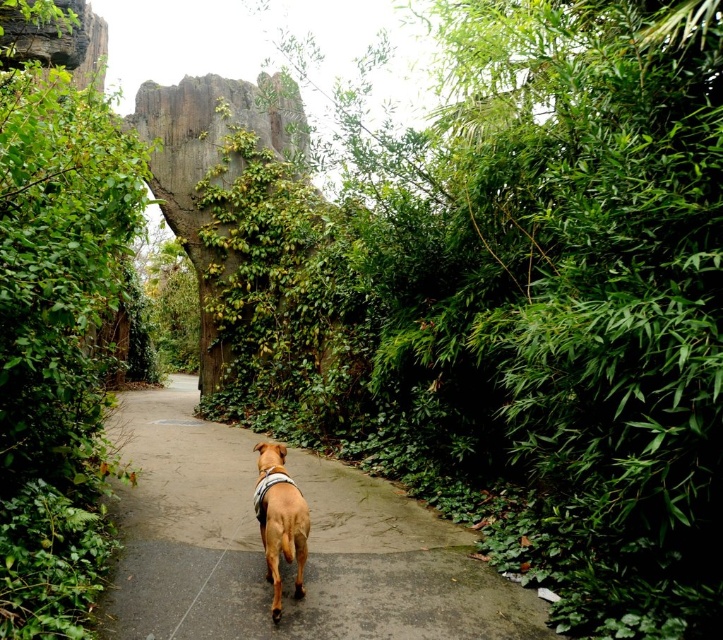
You are a gardener trying to trim the green leafy foliage at center and the green leafy bush at left. Which one do you need to reach higher to trim?

The green leafy foliage at center is positioned over the green leafy bush at left, so you need to reach higher to trim the green leafy foliage at center.

You are a hiker trying to navigate through the narrow pathway. You notice the green leafy foliage at center and the brown concrete path at center. Which one takes up more space in the scene?

The green leafy foliage at center has a larger size compared to the brown concrete path at center, so it takes up more space in the scene.

You are a hiker standing on the narrow pathway in the scene. You want to take a photo of both the green leafy foliage at center and the green mossy rock at center in the same frame. Which object should you focus on first to ensure both are in the shot?

You should focus on the green mossy rock at center first since it is taller than the green leafy foliage at center, so it will occupy more space in the frame.